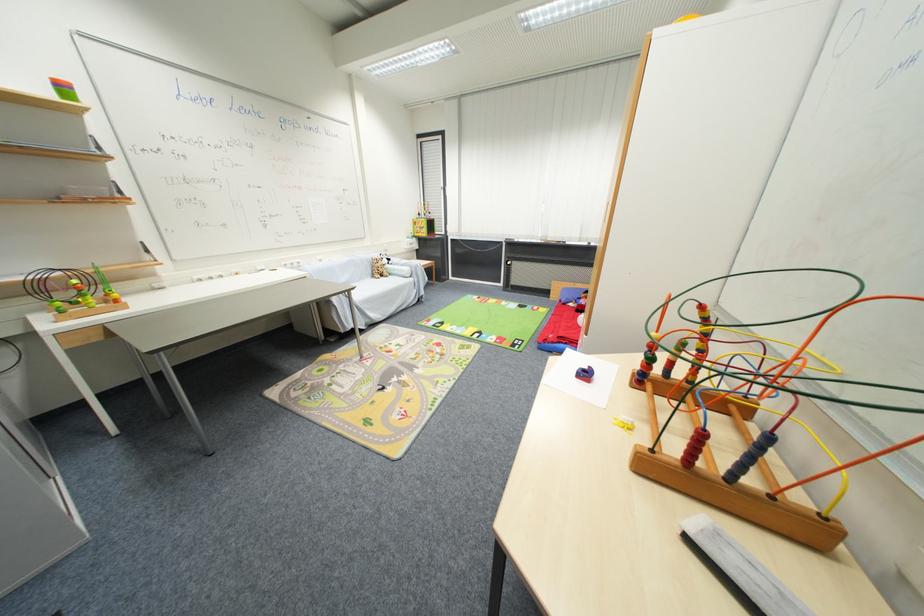
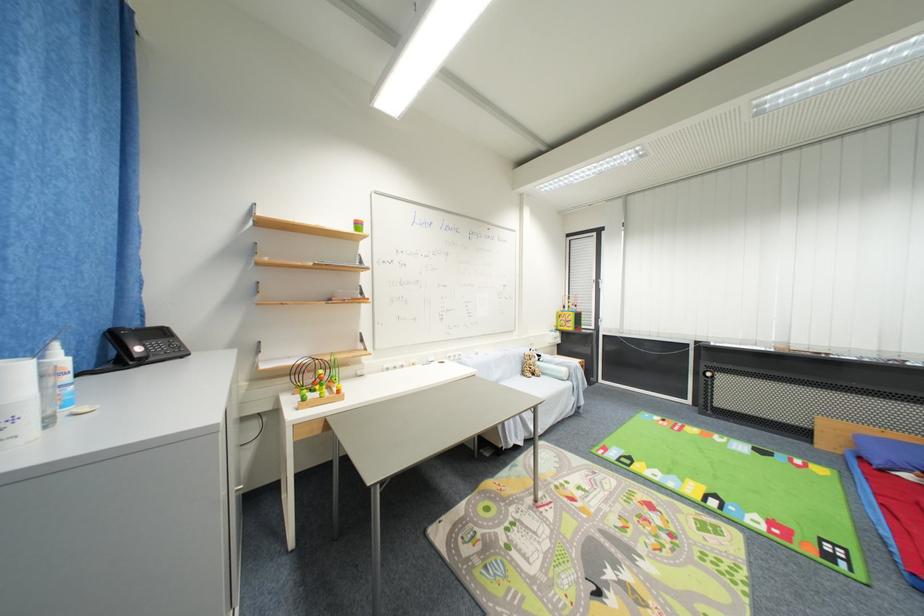
Question: In a continuous first-person perspective shot, in which direction is the camera moving?

Choices:
 (A) Left
 (B) Right
 (C) Forward
 (D) Backward

Answer: (A)